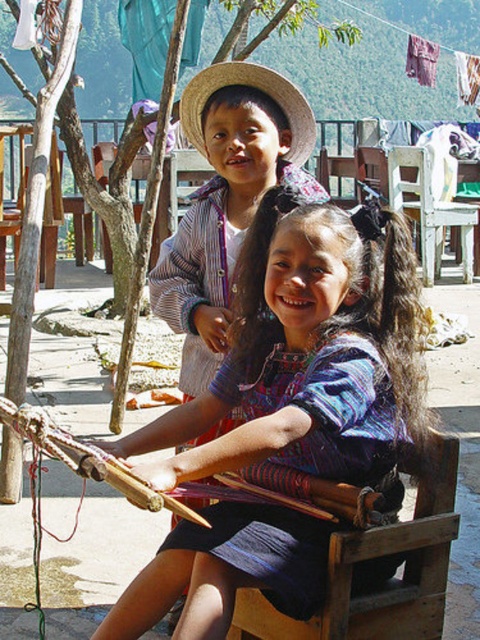
Is wooden chair at lower center to the right of wooden chair at left from the viewer's perspective?

Indeed, wooden chair at lower center is positioned on the right side of wooden chair at left.

Is wooden chair at lower center wider than wooden chair at left?

In fact, wooden chair at lower center might be narrower than wooden chair at left.

Which is behind, point (424, 524) or point (22, 147)?

The point (22, 147) is more distant.

This screenshot has height=640, width=480. What are the coordinates of `wooden chair at lower center` in the screenshot? It's located at (382, 557).

Is the position of blue woven fabric at center more distant than that of white plastic chair at center?

No, blue woven fabric at center is closer to the viewer.

Between blue woven fabric at center and white plastic chair at center, which one appears on the right side from the viewer's perspective?

white plastic chair at center

The width and height of the screenshot is (480, 640). Describe the element at coordinates (308, 356) in the screenshot. I see `blue woven fabric at center` at that location.

Where is `blue woven fabric at center`? The height and width of the screenshot is (640, 480). blue woven fabric at center is located at coordinates (308, 356).

Can you confirm if matte straw hat at upper center is positioned above white plastic chair at center?

No, matte straw hat at upper center is not above white plastic chair at center.

Who is positioned more to the right, matte straw hat at upper center or white plastic chair at center?

white plastic chair at center

Between point (206, 378) and point (415, 193), which one is positioned in front?

Point (206, 378) is in front.

Locate an element on the screen. matte straw hat at upper center is located at coordinates click(x=227, y=200).